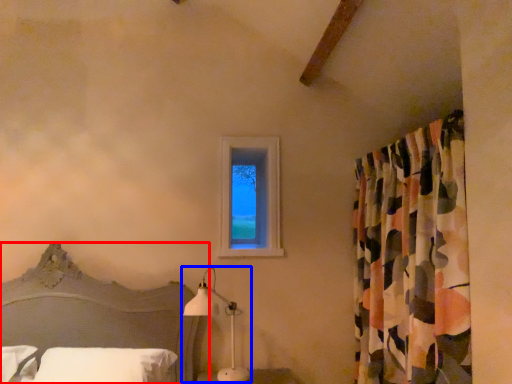
Question: Which object appears farthest to the camera in this image, bed (highlighted by a red box) or table lamp (highlighted by a blue box)?

Choices:
 (A) bed
 (B) table lamp

Answer: (B)